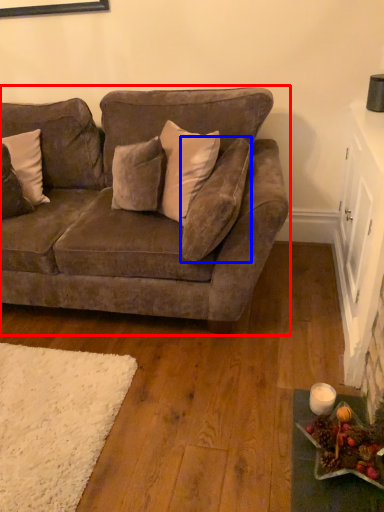
Question: Which object is closer to the camera taking this photo, studio couch (highlighted by a red box) or pillow (highlighted by a blue box)?

Choices:
 (A) studio couch
 (B) pillow

Answer: (A)